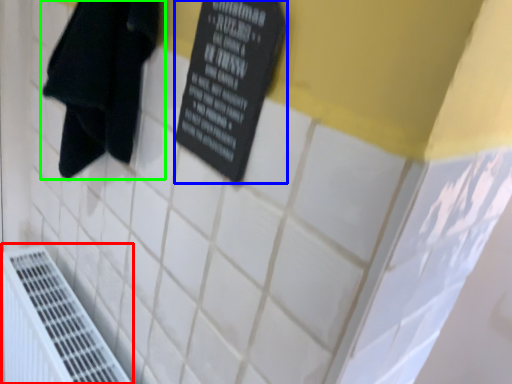
Question: Which is nearer to the air conditioning (highlighted by a red box)? bulletin board (highlighted by a blue box) or towel (highlighted by a green box).

Choices:
 (A) bulletin board
 (B) towel

Answer: (B)